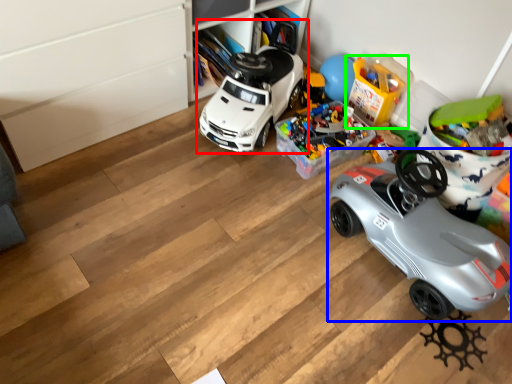
Question: Which object is positioned farthest from car (highlighted by a red box)? Select from car (highlighted by a blue box) and toy (highlighted by a green box).

Choices:
 (A) car
 (B) toy

Answer: (A)